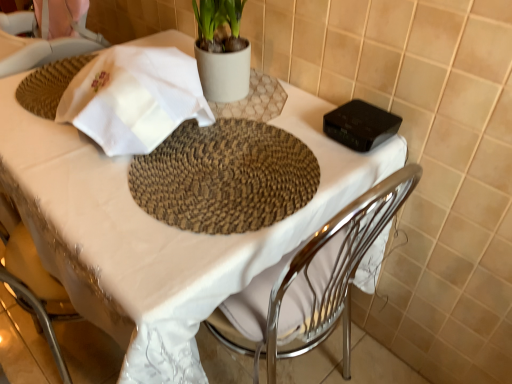
Question: Do you think white embroidered cloth at upper left is within white fabric table at center, or outside of it?

Choices:
 (A) outside
 (B) inside

Answer: (A)

Question: From the image's perspective, is white embroidered cloth at upper left positioned above or below white fabric table at center?

Choices:
 (A) below
 (B) above

Answer: (B)

Question: Relative to white fabric table at center, is white embroidered cloth at upper left in front or behind?

Choices:
 (A) behind
 (B) front

Answer: (A)

Question: Is point (371, 185) closer or farther from the camera than point (151, 104)?

Choices:
 (A) closer
 (B) farther

Answer: (B)

Question: Considering the positions of white fabric table at center and white embroidered cloth at upper left in the image, is white fabric table at center bigger or smaller than white embroidered cloth at upper left?

Choices:
 (A) small
 (B) big

Answer: (B)

Question: From a real-world perspective, relative to white embroidered cloth at upper left, is white fabric table at center vertically above or below?

Choices:
 (A) above
 (B) below

Answer: (B)

Question: From the image's perspective, is white fabric table at center above or below white embroidered cloth at upper left?

Choices:
 (A) below
 (B) above

Answer: (A)